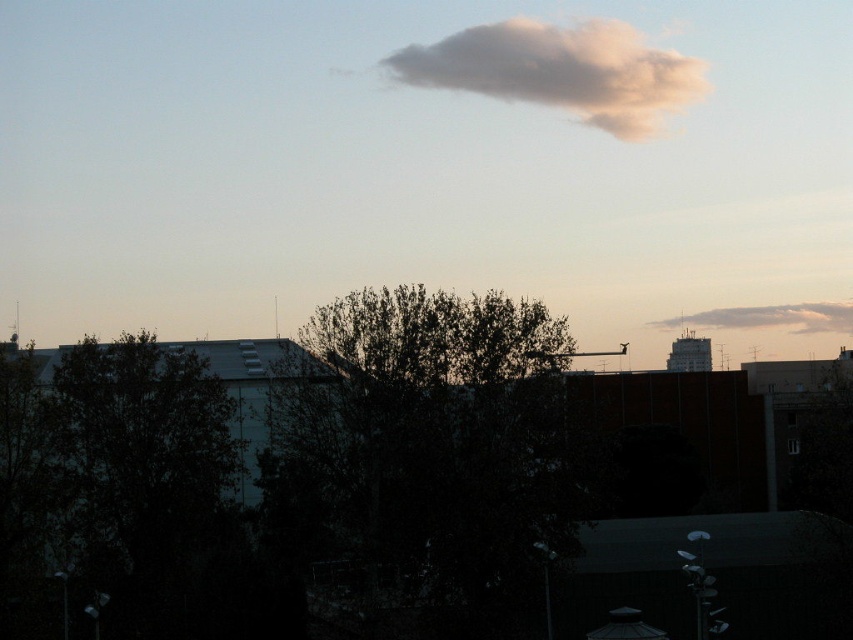
Between point (357, 358) and point (738, 321), which one is positioned behind?

Point (738, 321)

Between dark green leafy tree at center and white fluffy cloud at upper right, which one is positioned lower?

Positioned lower is dark green leafy tree at center.

I want to click on dark green leafy tree at center, so point(425,442).

From the picture: Is dark green leafy tree at center to the right of dark green leafy tree at left from the viewer's perspective?

Correct, you'll find dark green leafy tree at center to the right of dark green leafy tree at left.

Between point (367, 305) and point (28, 506), which one is positioned behind?

Positioned behind is point (367, 305).

Find the location of a particular element. The height and width of the screenshot is (640, 853). dark green leafy tree at center is located at coordinates (425, 442).

Locate an element on the screen. The height and width of the screenshot is (640, 853). dark green leafy tree at center is located at coordinates (425, 442).

Is dark green leafy tree at left in front of white fluffy cloud at upper right?

That is True.

The width and height of the screenshot is (853, 640). Describe the element at coordinates (122, 468) in the screenshot. I see `dark green leafy tree at left` at that location.

At what (x,y) coordinates should I click in order to perform the action: click on dark green leafy tree at left. Please return your answer as a coordinate pair (x, y). The height and width of the screenshot is (640, 853). Looking at the image, I should click on (122, 468).